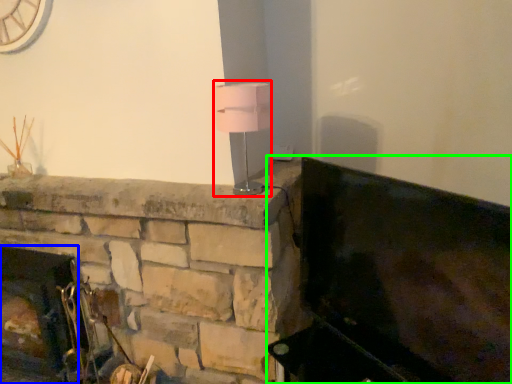
Question: Which is nearer to the table lamp (highlighted by a red box)? fireplace (highlighted by a blue box) or furniture (highlighted by a green box).

Choices:
 (A) fireplace
 (B) furniture

Answer: (B)